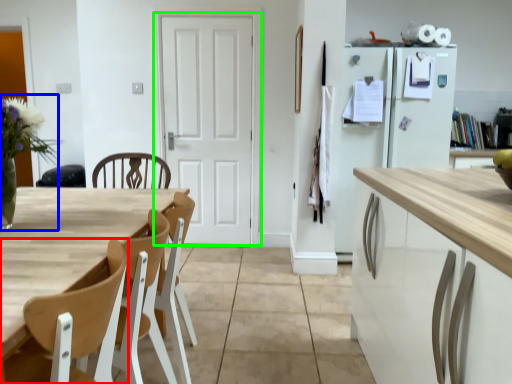
Question: Which object is positioned farthest from chair (highlighted by a red box)? Select from floral arrangement (highlighted by a blue box) and door (highlighted by a green box).

Choices:
 (A) floral arrangement
 (B) door

Answer: (B)